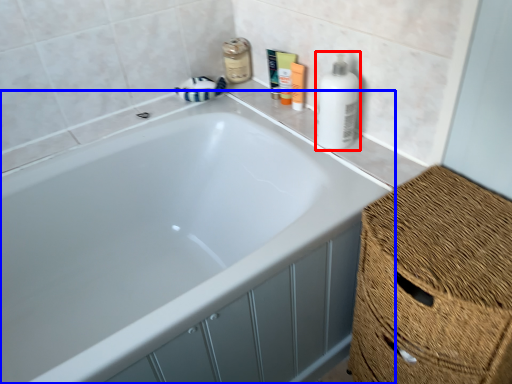
Question: Which object appears farthest to the camera in this image, cleaning product (highlighted by a red box) or bathtub (highlighted by a blue box)?

Choices:
 (A) cleaning product
 (B) bathtub

Answer: (A)